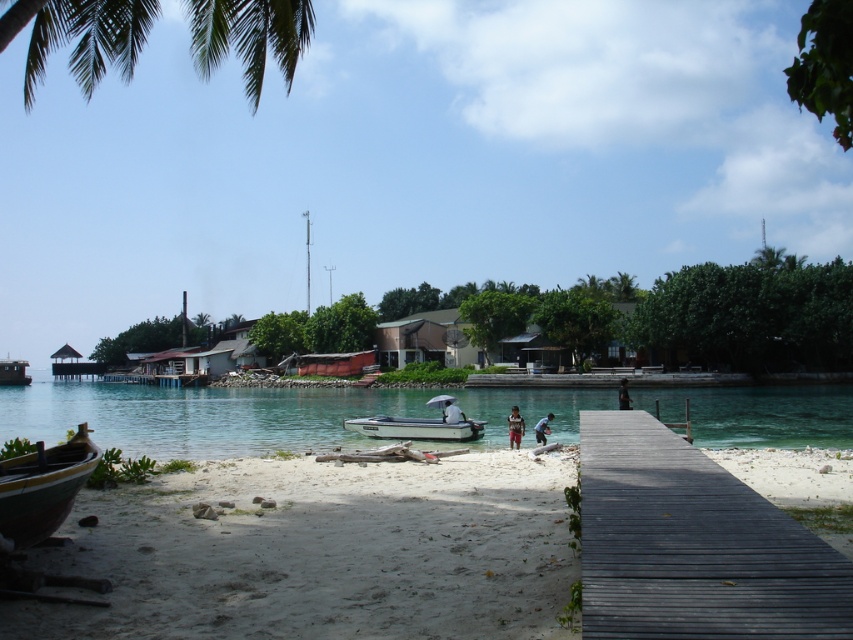
You are planning to set up a small picnic area on the beach. You have a picnic blanket that is 2 meters wide. The dark gray wood dock at lower right and the white matte umbrella at center are in your way. Which object will require you to adjust your blanket placement more due to its width?

The dark gray wood dock at lower right has a larger width than the white matte umbrella at center, so it will require more adjustment to the picnic blanket placement.

You are a photographer standing on the beach and want to take a photo of the clear blue water at center and the dark gray fabric shirt at center. Which object should you zoom in on to make them appear the same size in your photo?

The clear blue water at center is much taller than the dark gray fabric shirt at center, so you should zoom in on the clear blue water at center to make them appear the same size in your photo.